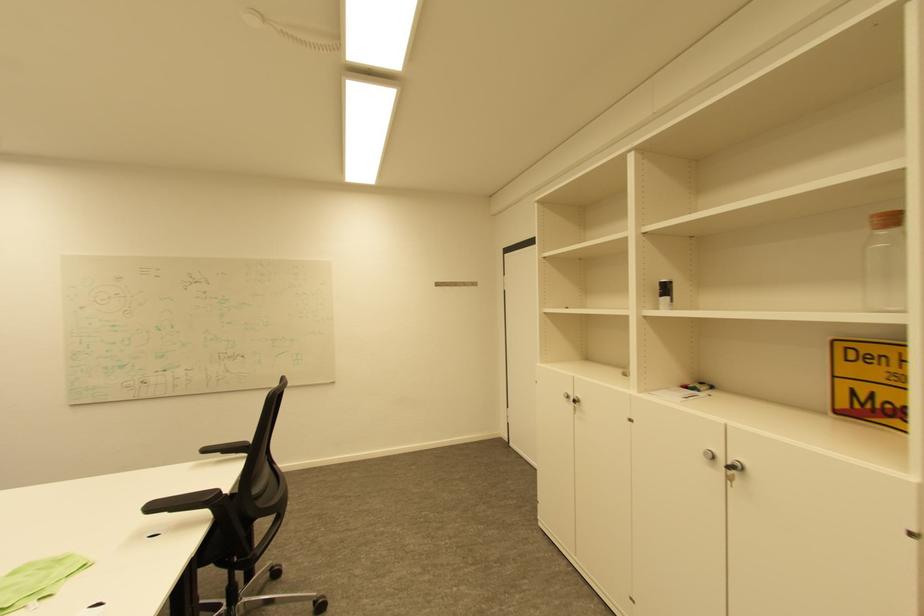
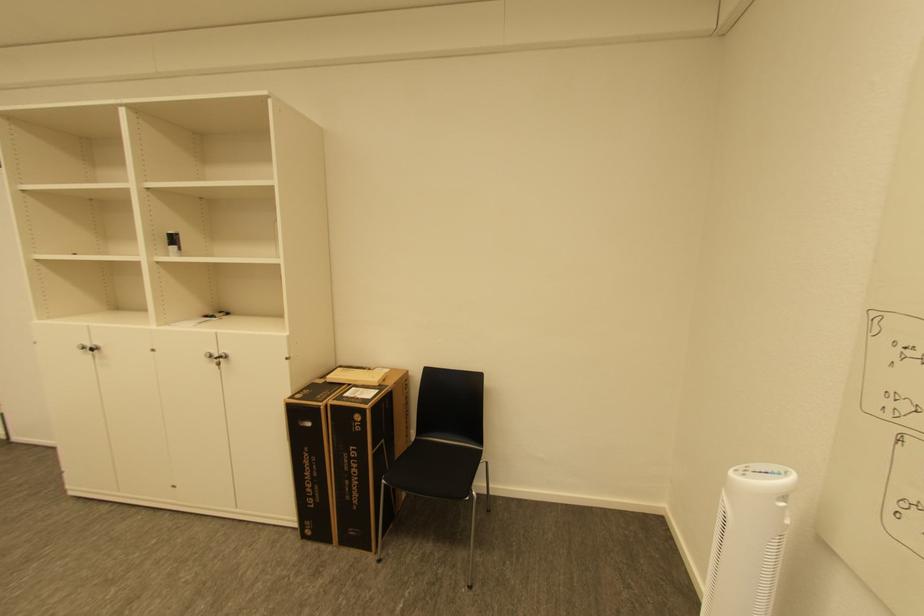
The point at (x=720, y=458) is marked in the first image. Where is the corresponding point in the second image?

(217, 357)